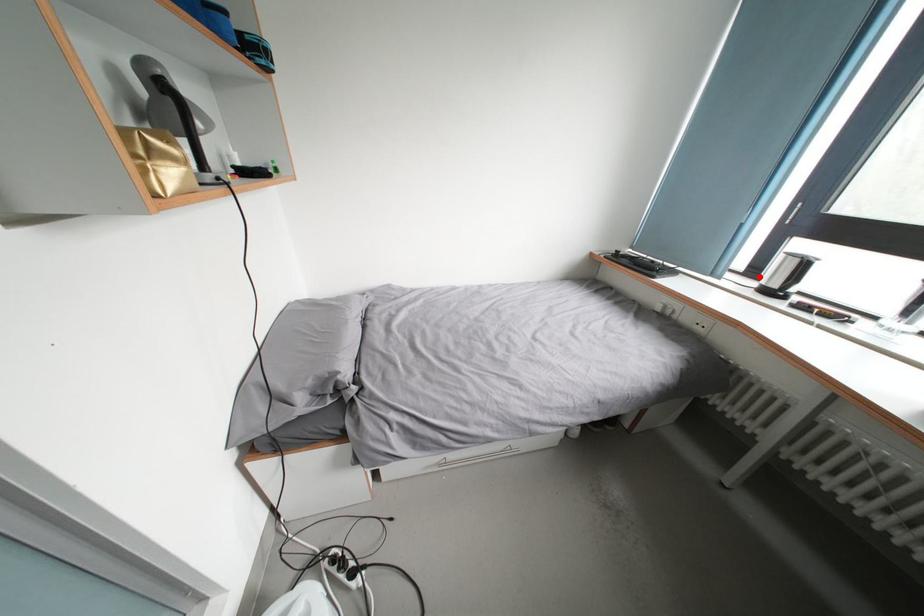
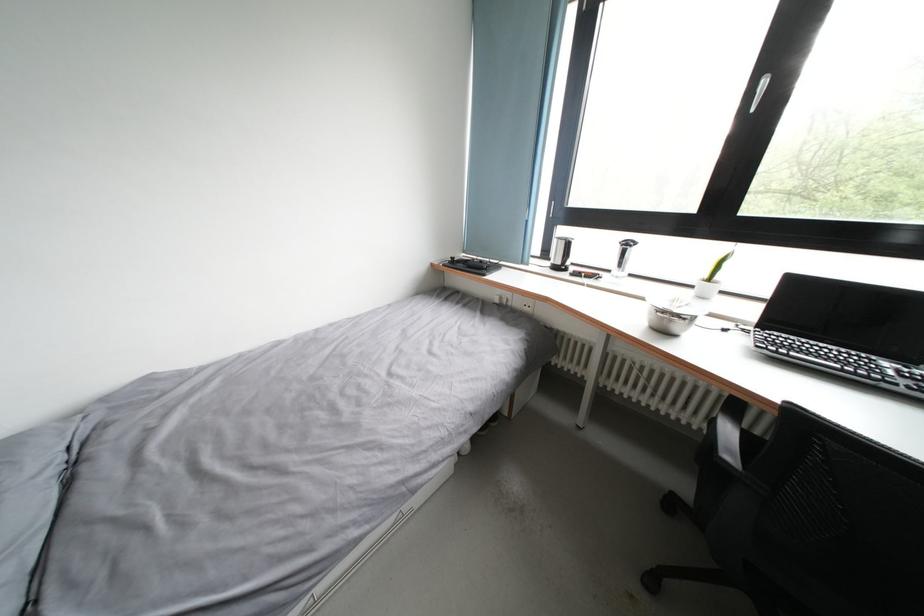
Find the pixel in the second image that matches the highlighted location in the first image.

(552, 259)